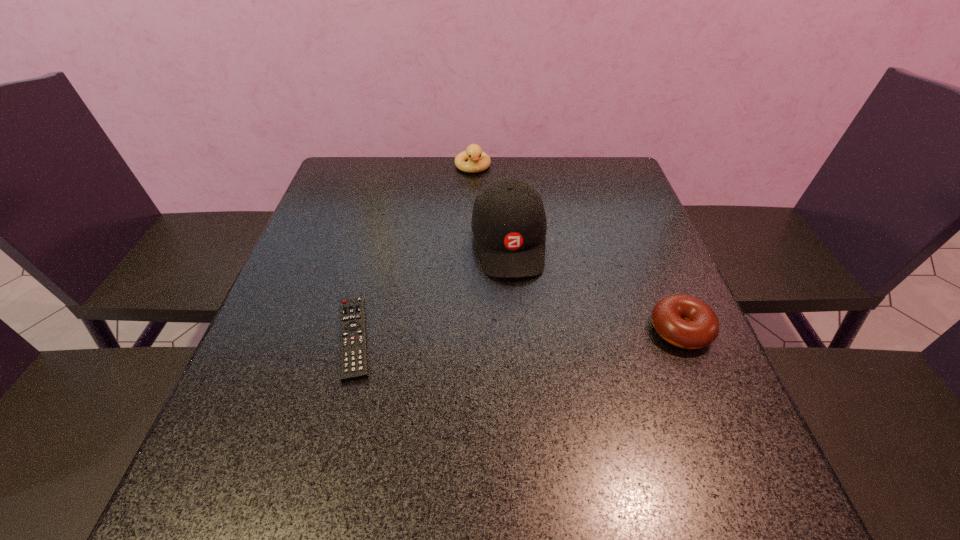
Find the location of `remote control`. remote control is located at coordinates (353, 346).

Where is `the leftmost object`? Image resolution: width=960 pixels, height=540 pixels. the leftmost object is located at coordinates (353, 346).

Find the location of a particular element. The width and height of the screenshot is (960, 540). doughnut is located at coordinates (684, 321).

Where is `the rightmost object`? The height and width of the screenshot is (540, 960). the rightmost object is located at coordinates (684, 321).

Locate an element on the screen. The width and height of the screenshot is (960, 540). the third nearest object is located at coordinates (509, 224).

Find the location of a particular element. baseball cap is located at coordinates (509, 224).

Identify the location of the farthest object. The width and height of the screenshot is (960, 540). (478, 161).

Image resolution: width=960 pixels, height=540 pixels. I want to click on duckling, so click(478, 161).

The width and height of the screenshot is (960, 540). In order to click on blank area located 0.220m on the back of the shortest object in this screenshot , I will do `click(380, 237)`.

Locate an element on the screen. The width and height of the screenshot is (960, 540). vacant space located on the back of the rightmost object is located at coordinates (637, 227).